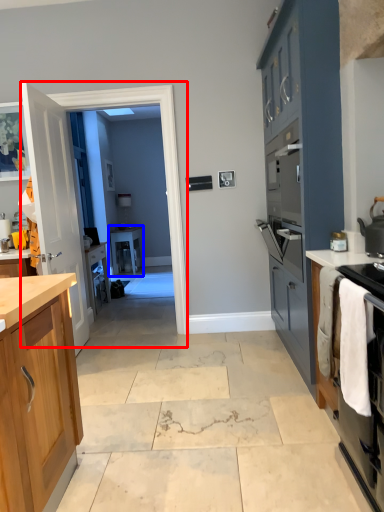
Question: Which point is further to the camera, glass door (highlighted by a red box) or table (highlighted by a blue box)?

Choices:
 (A) glass door
 (B) table

Answer: (B)